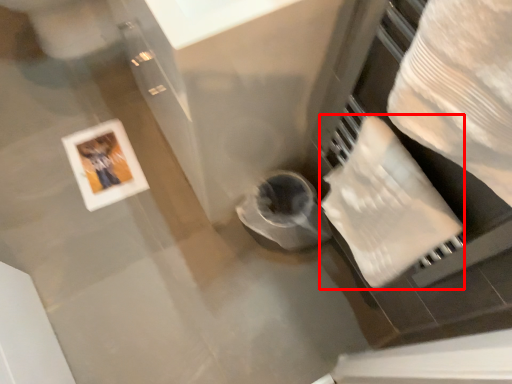
Question: Observing the image, what is the correct spatial positioning of toilet paper (annotated by the red box) in reference to picture frame?

Choices:
 (A) right
 (B) left

Answer: (A)